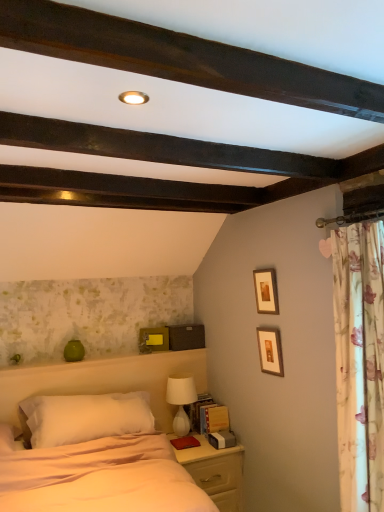
This screenshot has width=384, height=512. I want to click on free space in front of yellow matte picture frame at upper center, positioned as the 3th picture frame in right-to-left order, so click(147, 356).